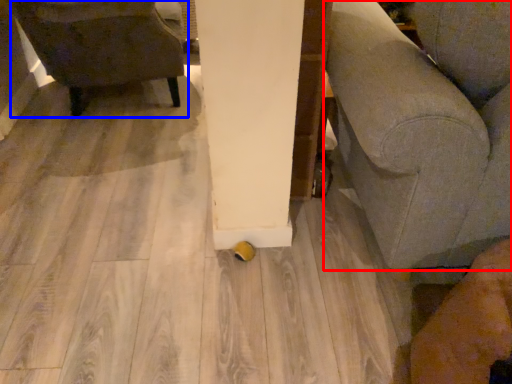
Question: Which point is further to the camera, furniture (highlighted by a red box) or chair (highlighted by a blue box)?

Choices:
 (A) furniture
 (B) chair

Answer: (B)